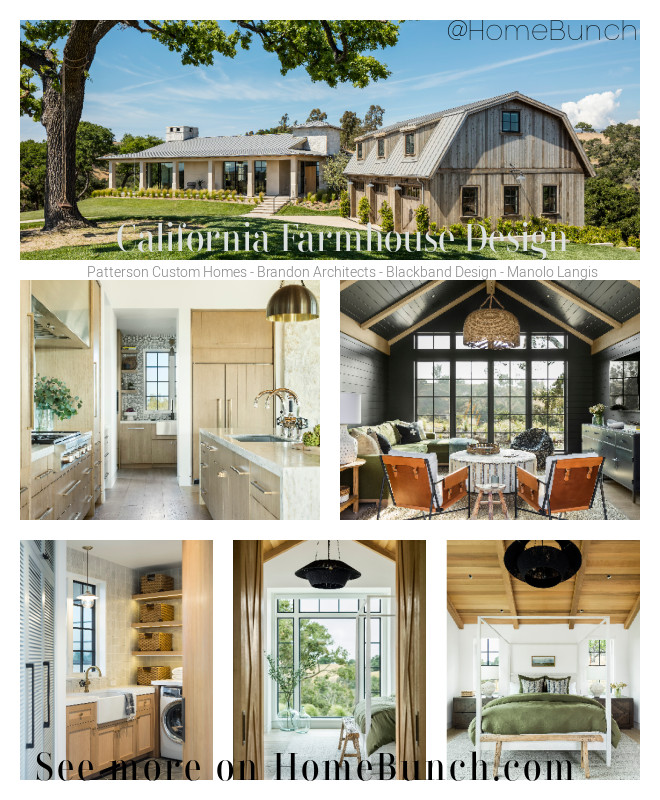
Identify the location of pillows. This screenshot has height=800, width=660. (532, 686), (546, 685).